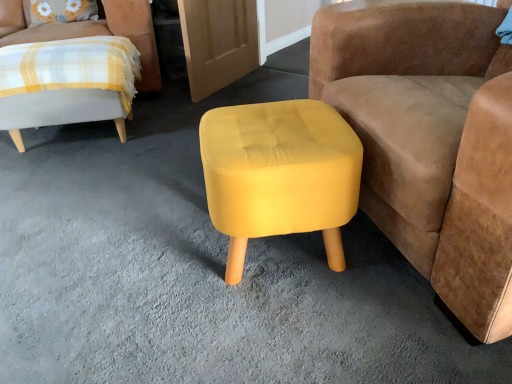
Locate an element on the screen. vacant region to the left of velvet mustard stool at center, which is counted as the 2th chair, starting from the left is located at coordinates (178, 254).